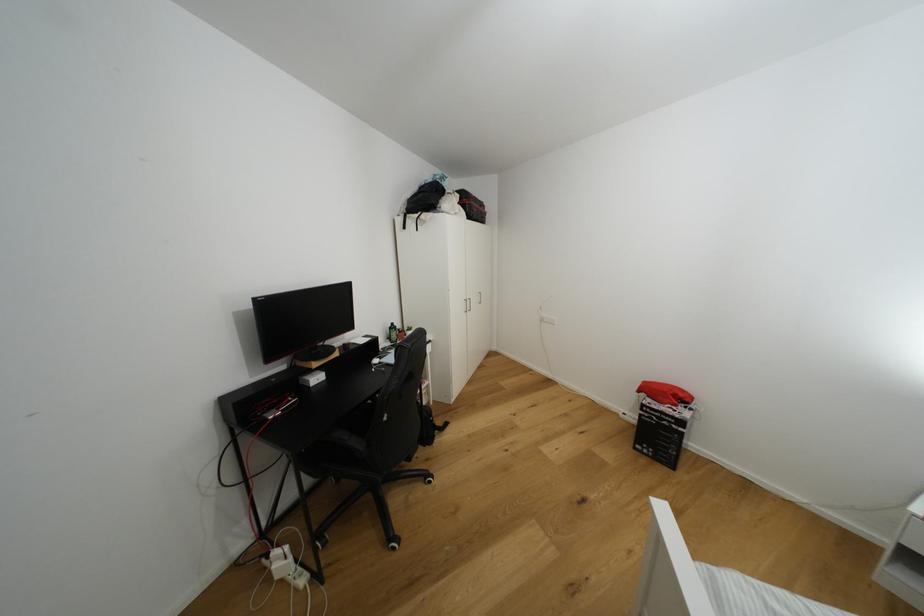
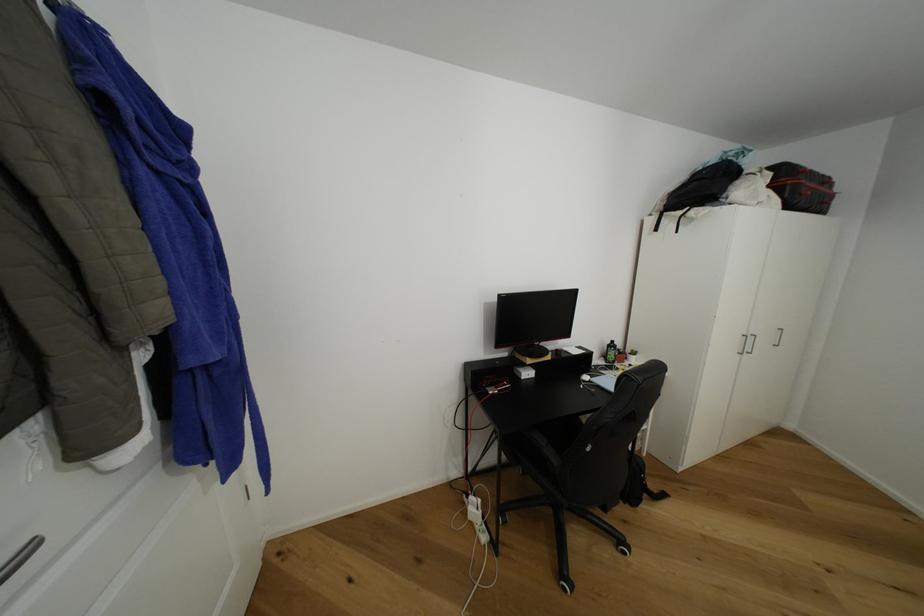
Question: The images are taken continuously from a first-person perspective. In which direction is your viewpoint rotating?

Choices:
 (A) Left
 (B) Right
 (C) Up
 (D) Down

Answer: (A)